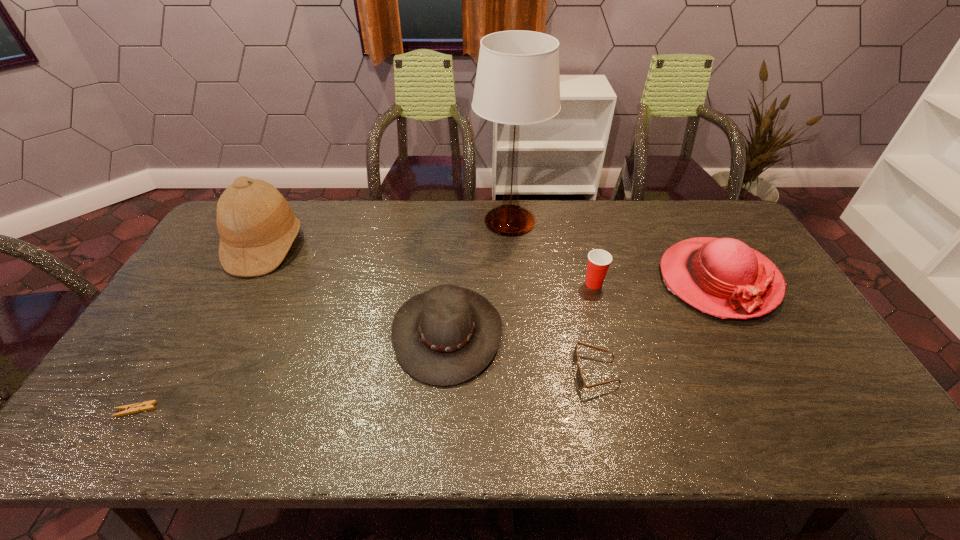
The width and height of the screenshot is (960, 540). I want to click on table lamp located in the far edge section of the desktop, so click(517, 82).

Identify the location of hat located at the far edge. Image resolution: width=960 pixels, height=540 pixels. click(x=257, y=227).

Locate an element on the screen. The image size is (960, 540). object present at the near edge is located at coordinates (148, 405).

Identify the location of hat situated at the left edge. The height and width of the screenshot is (540, 960). (257, 227).

Locate an element on the screen. clothespin positioned at the left edge is located at coordinates (148, 405).

At what (x,y) coordinates should I click in order to perform the action: click on object at the right edge. Please return your answer as a coordinate pair (x, y). Looking at the image, I should click on (723, 277).

Find the location of `object present at the far left corner`. object present at the far left corner is located at coordinates (257, 227).

The width and height of the screenshot is (960, 540). In order to click on object situated at the near left corner in this screenshot , I will do `click(148, 405)`.

Where is `vacant space at the far edge of the desktop`? This screenshot has width=960, height=540. vacant space at the far edge of the desktop is located at coordinates (680, 232).

In the image, there is a desktop. In order to click on vacant space at the near edge in this screenshot , I will do `click(496, 418)`.